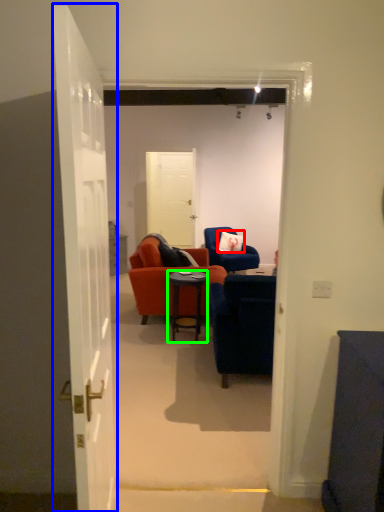
Question: Based on their relative distances, which object is farther from pillow (highlighted by a red box)? Choose from door (highlighted by a blue box) and desk (highlighted by a green box).

Choices:
 (A) door
 (B) desk

Answer: (A)